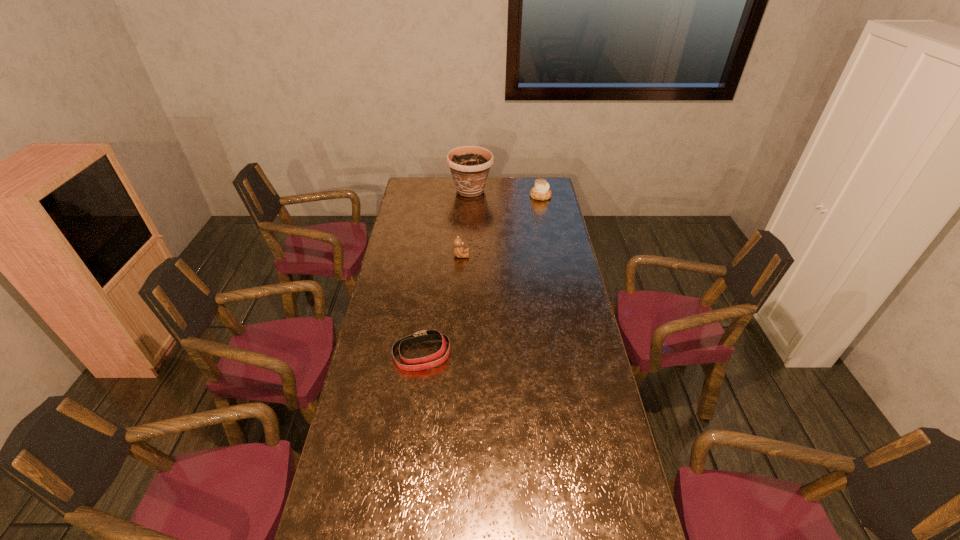
Locate an element on the screen. The image size is (960, 540). vacant region that satisfies the following two spatial constraints: 1. on the front side of the flowerpot; 2. on the face of the teddy bear is located at coordinates (468, 255).

The height and width of the screenshot is (540, 960). Find the location of `vacant space that satisfies the following two spatial constraints: 1. on the front side of the rightmost object; 2. on the face of the teddy bear`. vacant space that satisfies the following two spatial constraints: 1. on the front side of the rightmost object; 2. on the face of the teddy bear is located at coordinates (552, 255).

The image size is (960, 540). I want to click on free space in the image that satisfies the following two spatial constraints: 1. on the front side of the tallest object; 2. on the face of the teddy bear, so click(468, 255).